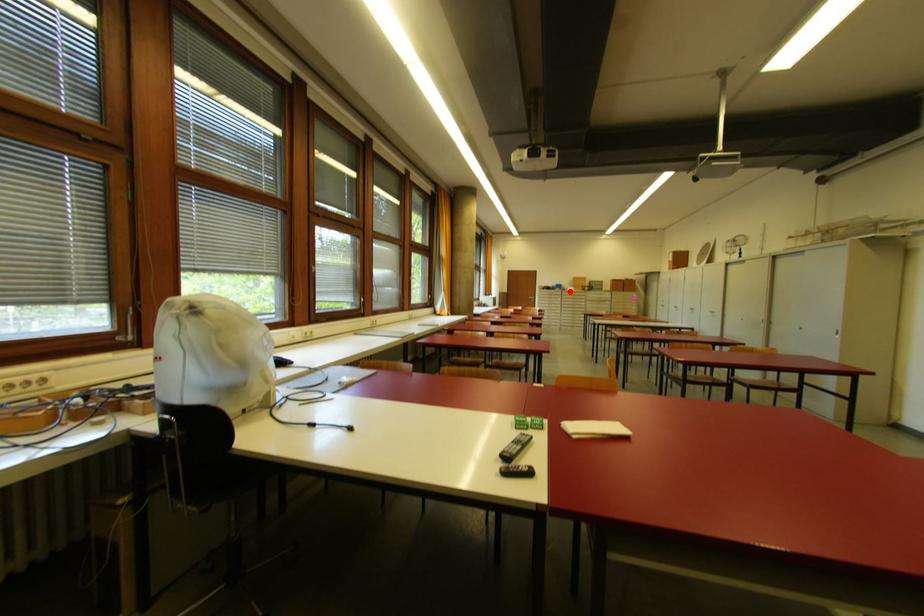
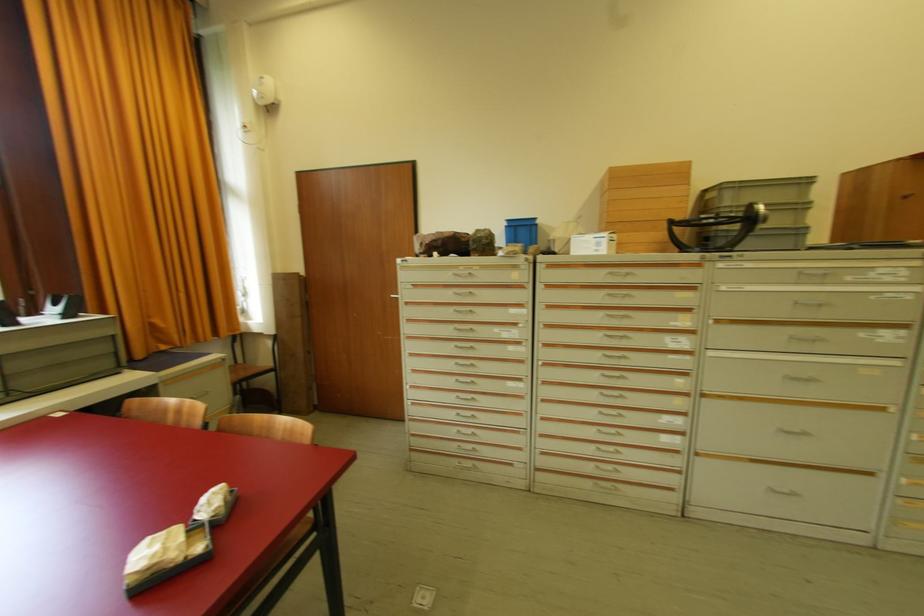
Locate, in the second image, the point that corresponds to the highlighted location in the first image.

(570, 254)